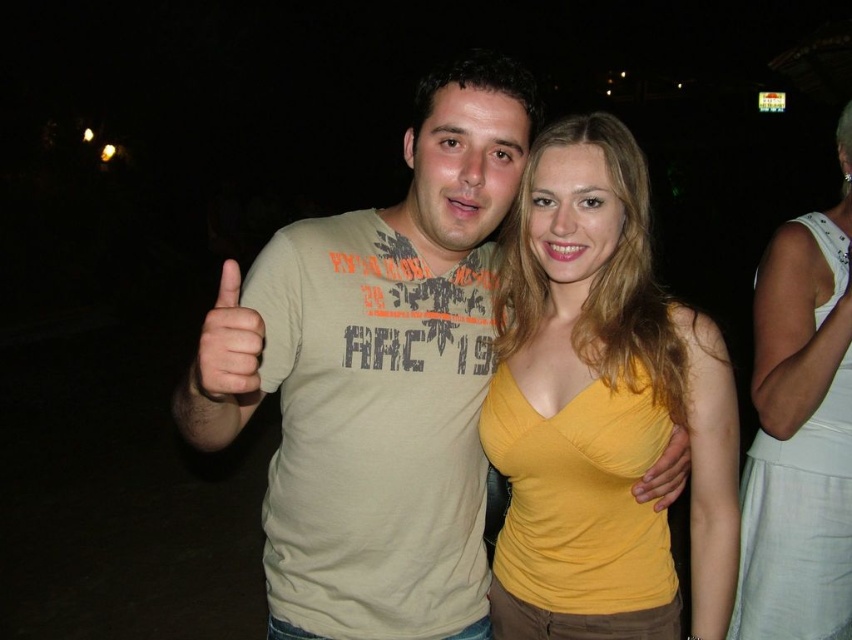
You are standing at point (x=403, y=253) and want to take a photo of the two people in the scene. The camera you have can only focus on objects within a 4.5 feet range. Will you be able to capture both individuals in focus?

The two people are 4.74 feet apart, so the distance between them exceeds the camera focus range of 4.5 feet. Therefore, you cannot capture both individuals in focus simultaneously.